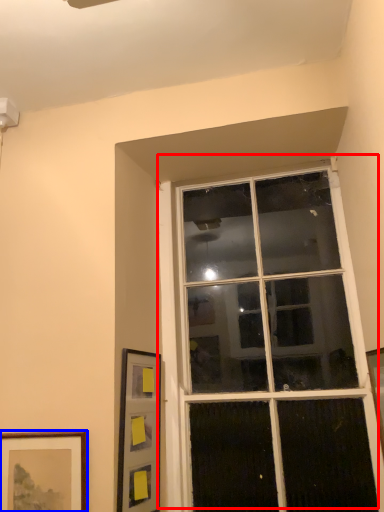
Question: Which point is further to the camera, window (highlighted by a red box) or picture frame (highlighted by a blue box)?

Choices:
 (A) window
 (B) picture frame

Answer: (A)